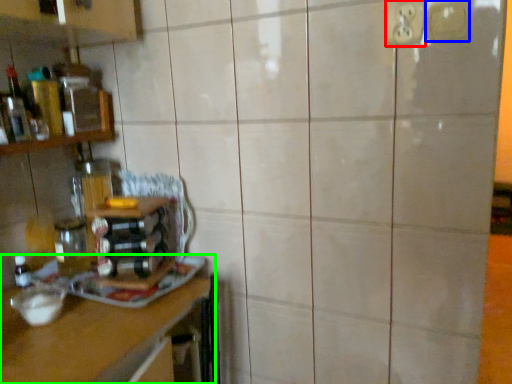
Question: Based on their relative distances, which object is nearer to electric outlet (highlighted by a red box)? Choose from electric outlet (highlighted by a blue box) and countertop (highlighted by a green box).

Choices:
 (A) electric outlet
 (B) countertop

Answer: (A)